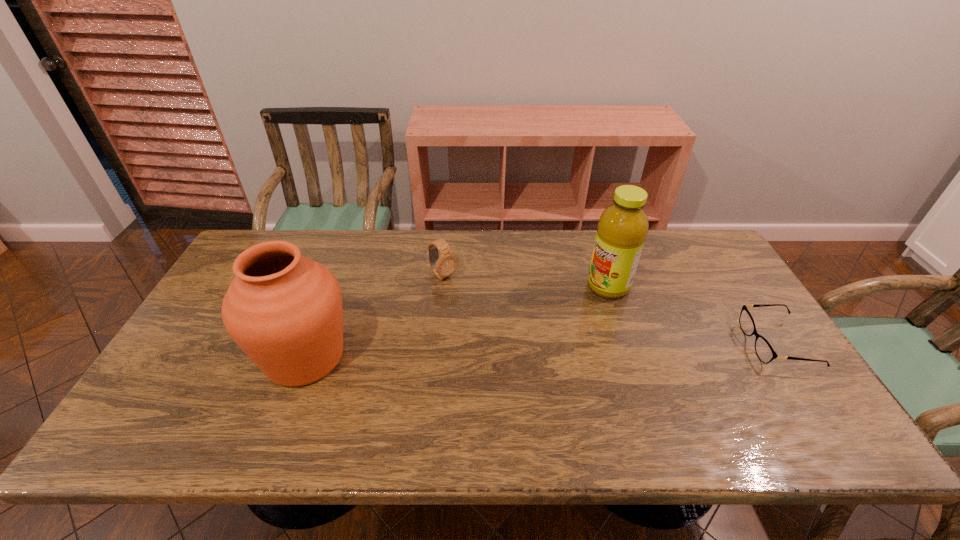
Identify the location of urn. (284, 310).

Locate an element on the screen. Image resolution: width=960 pixels, height=540 pixels. the rightmost object is located at coordinates (763, 349).

At what (x,y) coordinates should I click in order to perform the action: click on the shortest object. Please return your answer as a coordinate pair (x, y). This screenshot has width=960, height=540. Looking at the image, I should click on (763, 349).

Where is `the second object from left to right`? Image resolution: width=960 pixels, height=540 pixels. the second object from left to right is located at coordinates (443, 266).

Locate an element on the screen. Image resolution: width=960 pixels, height=540 pixels. the second shortest object is located at coordinates (443, 266).

This screenshot has height=540, width=960. In order to click on fruit juice in this screenshot , I will do `click(622, 229)`.

You are a GUI agent. You are given a task and a screenshot of the screen. Output one action in this format:
    pyautogui.click(x=<x>, y=<y>)
    Task: Click on the vacant area situated 0.260m on the right of the urn
    This screenshot has height=540, width=960.
    Given the screenshot: What is the action you would take?
    pyautogui.click(x=454, y=357)

Where is `free space located 0.120m on the front-facing side of the shortest object`? The width and height of the screenshot is (960, 540). free space located 0.120m on the front-facing side of the shortest object is located at coordinates (706, 344).

You are a GUI agent. You are given a task and a screenshot of the screen. Output one action in this format:
    pyautogui.click(x=<x>, y=<y>)
    Task: Click on the free space located 0.090m on the front-facing side of the shortest object
    
    Given the screenshot: What is the action you would take?
    coord(716,344)

At what (x,y) coordinates should I click in order to perform the action: click on vacant region located on the front-facing side of the shortest object. Please return your answer as a coordinate pair (x, y). Looking at the image, I should click on pyautogui.click(x=616, y=344).